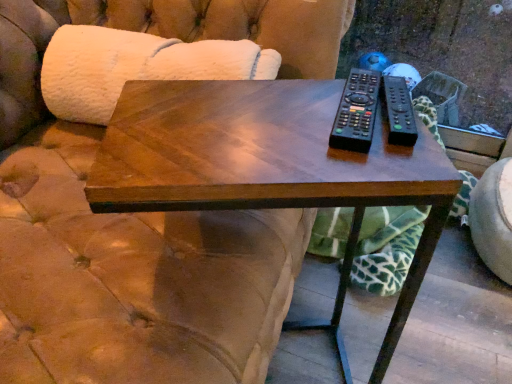
Question: Considering the positions of white fluffy couch at upper left and black plastic remote at right, marked as the second remote in a left-to-right arrangement, in the image, is white fluffy couch at upper left taller or shorter than black plastic remote at right, marked as the second remote in a left-to-right arrangement,?

Choices:
 (A) short
 (B) tall

Answer: (B)

Question: Would you say white fluffy couch at upper left is inside or outside black plastic remote at right, marked as the second remote in a left-to-right arrangement?

Choices:
 (A) inside
 (B) outside

Answer: (B)

Question: Which object is positioned farthest from the black plastic remote at right, the first remote viewed from the right?

Choices:
 (A) black plastic remote at upper right, the 1th remote from the left
 (B) shiny wood coffee table at center
 (C) white fluffy couch at upper left

Answer: (C)

Question: Considering the real-world distances, which object is farthest from the black plastic remote at right, marked as the second remote in a left-to-right arrangement?

Choices:
 (A) shiny wood coffee table at center
 (B) white fluffy couch at upper left
 (C) black plastic remote at upper right, positioned as the second remote in right-to-left order

Answer: (B)